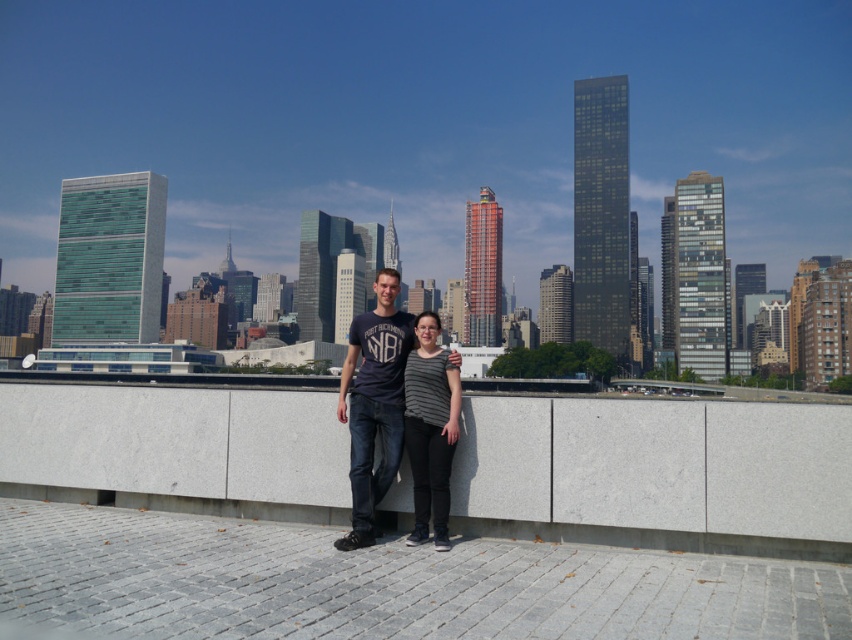
Does dark blue jeans at center appear on the right side of striped fabric shirt at center?

In fact, dark blue jeans at center is to the left of striped fabric shirt at center.

Is dark blue jeans at center positioned behind striped fabric shirt at center?

Yes, it is behind striped fabric shirt at center.

Between point (367, 470) and point (442, 464), which one is positioned in front?

Point (442, 464) is in front.

Where is `dark blue jeans at center`? The height and width of the screenshot is (640, 852). dark blue jeans at center is located at coordinates (373, 403).